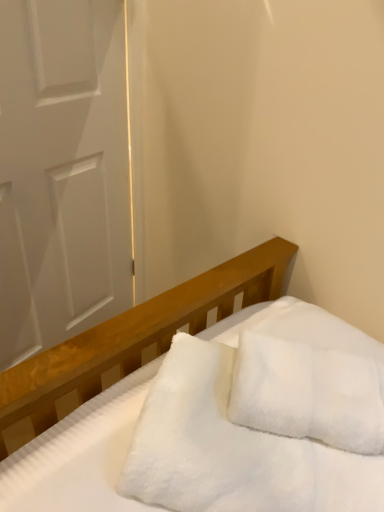
Question: From the image's perspective, is white matte door at left positioned above or below white fluffy blanket at center?

Choices:
 (A) above
 (B) below

Answer: (A)

Question: Considering the positions of white matte door at left and white fluffy blanket at center in the image, is white matte door at left taller or shorter than white fluffy blanket at center?

Choices:
 (A) tall
 (B) short

Answer: (A)

Question: Considering the real-world distances, which object is closest to the white fluffy blanket at center?

Choices:
 (A) white matte door at left
 (B) white fluffy pillow at center

Answer: (B)

Question: Estimate the real-world distances between objects in this image. Which object is closer to the white matte door at left?

Choices:
 (A) white fluffy pillow at center
 (B) white fluffy blanket at center

Answer: (B)